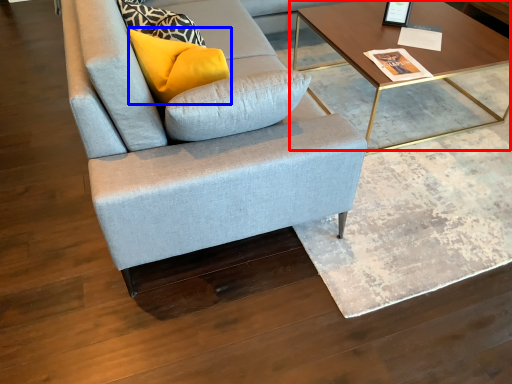
Question: Which object appears closest to the camera in this image, coffee table (highlighted by a red box) or pillow (highlighted by a blue box)?

Choices:
 (A) coffee table
 (B) pillow

Answer: (B)